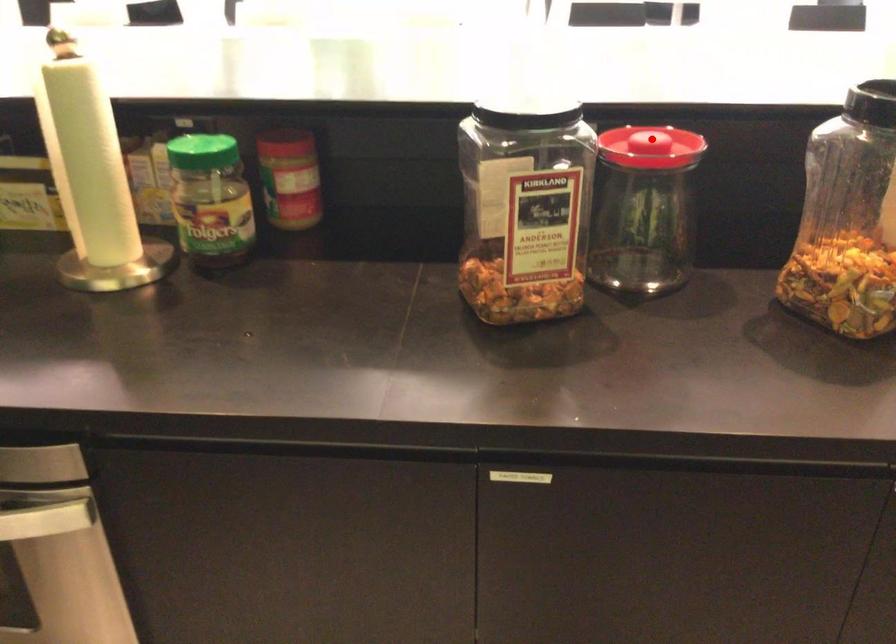
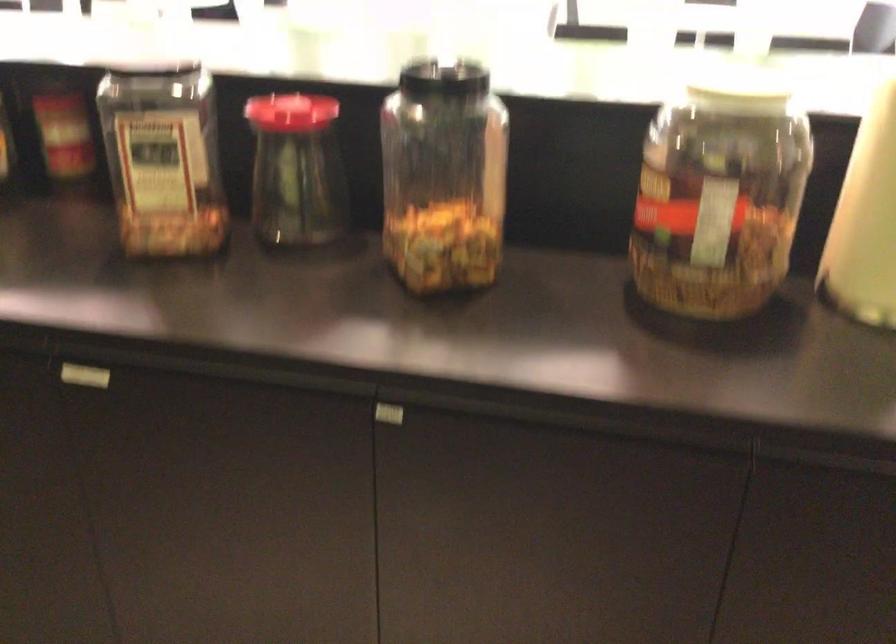
Question: I am providing you with two images of the same scene from different viewpoints. Image1 has a red point marked. In image2, the corresponding 3D location appears at what relative position? Reply with the corresponding letter.

Choices:
 (A) Closer
 (B) Farther

Answer: (B)